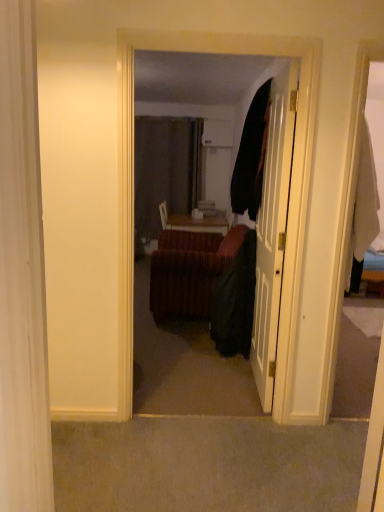
Locate an element on the screen. This screenshot has height=512, width=384. vacant space situated on the left part of velvet couch at center is located at coordinates (124, 436).